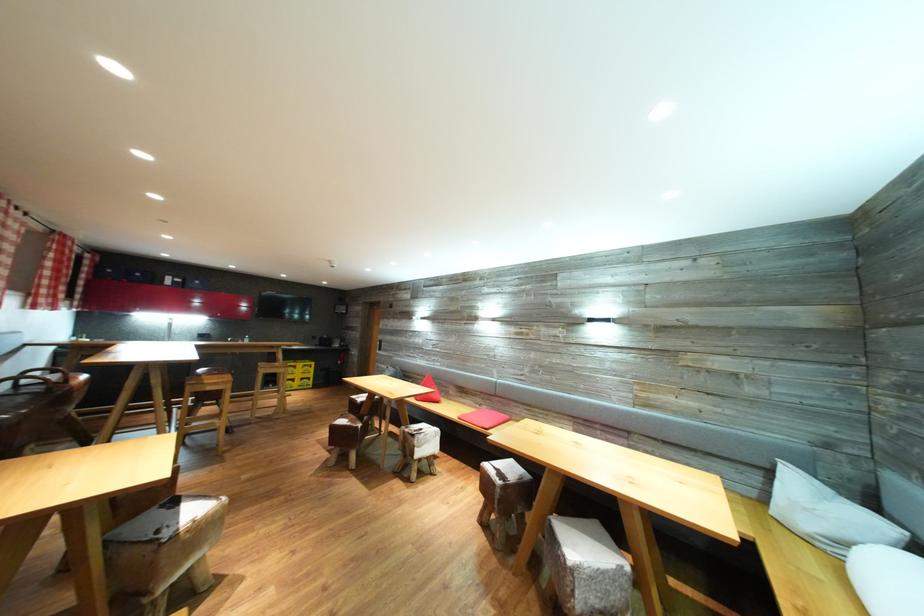
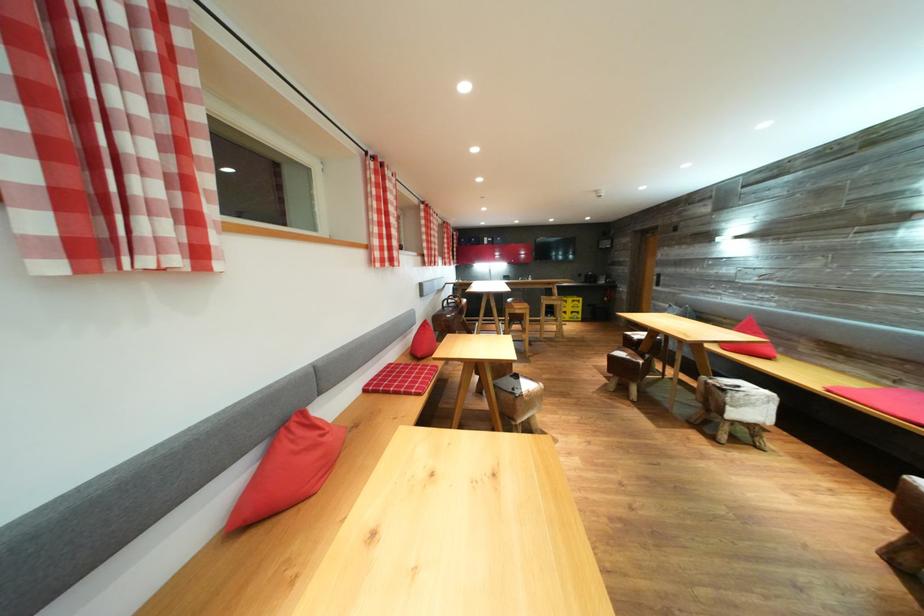
Locate, in the second image, the point that corresponds to (428,435) in the first image.

(745, 392)